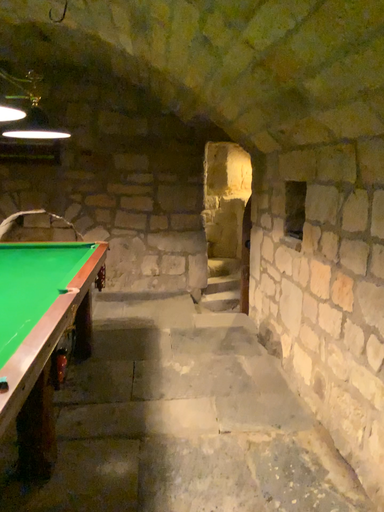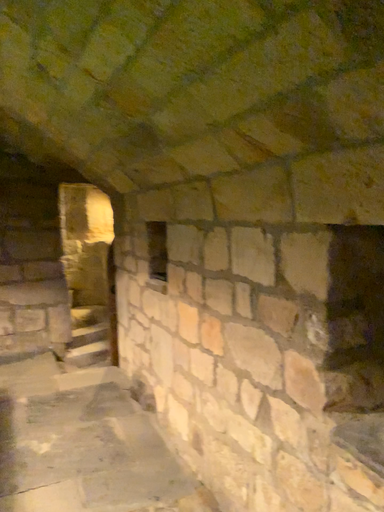
Question: How did the camera likely rotate when shooting the video?

Choices:
 (A) rotated right
 (B) rotated left

Answer: (A)